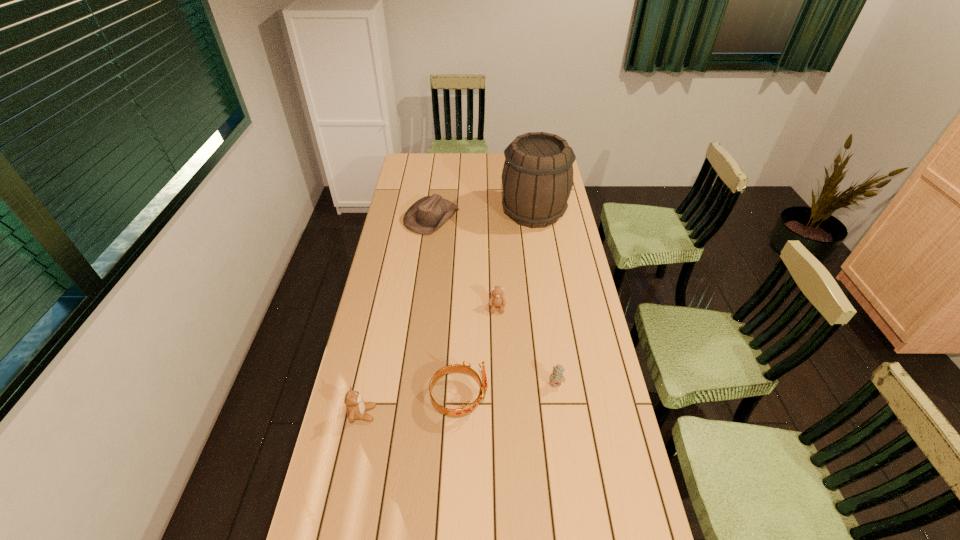
What are the coordinates of `vacant space situated on the front-facing side of the leftmost teddy bear` in the screenshot? It's located at (416, 414).

Where is `vacant area situated 0.140m on the front of the fedora`? The height and width of the screenshot is (540, 960). vacant area situated 0.140m on the front of the fedora is located at coordinates (426, 258).

This screenshot has width=960, height=540. Identify the location of free space located 0.100m on the front-facing side of the third object from right to left. (498, 336).

The width and height of the screenshot is (960, 540). Find the location of `vacant space positioned on the front-facing side of the rightmost teddy bear`. vacant space positioned on the front-facing side of the rightmost teddy bear is located at coordinates tap(564, 437).

In order to click on teddy bear that is positioned at the left edge in this screenshot , I will do `click(356, 408)`.

Where is `fedora located at the left edge`? The height and width of the screenshot is (540, 960). fedora located at the left edge is located at coordinates (429, 213).

The image size is (960, 540). Identify the location of wine bucket that is positioned at the right edge. (537, 179).

Find the location of a particular element. The height and width of the screenshot is (540, 960). teddy bear at the right edge is located at coordinates (556, 377).

Find the location of a particular element. vacant space at the far edge of the desktop is located at coordinates (445, 169).

Identify the location of vacant area at the left edge. This screenshot has height=540, width=960. (386, 377).